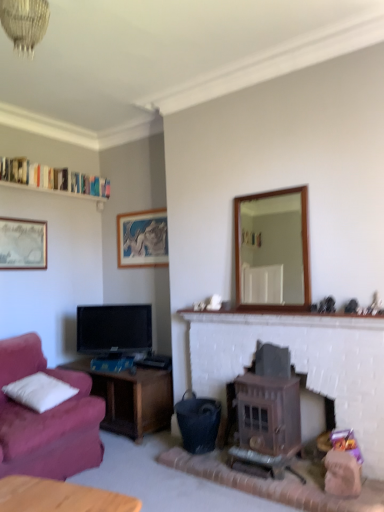
Question: Is brown wooden wood burning stove at center-right oriented towards white fluffy pillow at left?

Choices:
 (A) yes
 (B) no

Answer: (B)

Question: From a real-world perspective, is brown wooden wood burning stove at center-right positioned under white fluffy pillow at left based on gravity?

Choices:
 (A) yes
 (B) no

Answer: (A)

Question: Can you confirm if brown wooden wood burning stove at center-right is thinner than white fluffy pillow at left?

Choices:
 (A) no
 (B) yes

Answer: (A)

Question: Considering the relative sizes of brown wooden wood burning stove at center-right and white fluffy pillow at left in the image provided, is brown wooden wood burning stove at center-right smaller than white fluffy pillow at left?

Choices:
 (A) yes
 (B) no

Answer: (B)

Question: From a real-world perspective, is brown wooden wood burning stove at center-right over white fluffy pillow at left?

Choices:
 (A) yes
 (B) no

Answer: (B)

Question: Can you confirm if brown wooden wood burning stove at center-right is shorter than white fluffy pillow at left?

Choices:
 (A) yes
 (B) no

Answer: (B)

Question: Does wooden-framed mirror at center-right have a lesser width compared to matte wooden picture frame at upper center, the first picture frame viewed from the right?

Choices:
 (A) yes
 (B) no

Answer: (B)

Question: From a real-world perspective, is wooden-framed mirror at center-right over matte wooden picture frame at upper center, the 1th picture frame in the back-to-front sequence?

Choices:
 (A) no
 (B) yes

Answer: (A)

Question: Is wooden-framed mirror at center-right not near matte wooden picture frame at upper center, the second picture frame viewed from the left?

Choices:
 (A) no
 (B) yes

Answer: (B)

Question: Would you say wooden-framed mirror at center-right is outside matte wooden picture frame at upper center, the second picture frame in the front-to-back sequence?

Choices:
 (A) yes
 (B) no

Answer: (A)

Question: Is wooden-framed mirror at center-right facing away from matte wooden picture frame at upper center, the second picture frame viewed from the left?

Choices:
 (A) yes
 (B) no

Answer: (B)

Question: Are wooden-framed mirror at center-right and matte wooden picture frame at upper center, the second picture frame viewed from the left, beside each other?

Choices:
 (A) no
 (B) yes

Answer: (A)

Question: From the image's perspective, is white fluffy pillow at left under crystal glass chandelier at upper center?

Choices:
 (A) no
 (B) yes

Answer: (B)